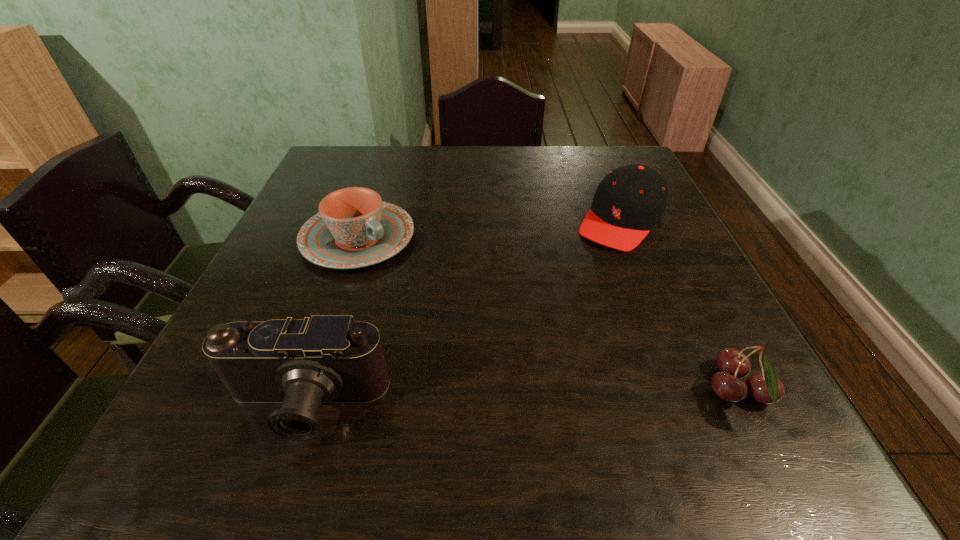
Find the location of `camera positioned at the near edge`. camera positioned at the near edge is located at coordinates (301, 363).

The image size is (960, 540). Identify the location of cherry situated at the near edge. coord(766,388).

The width and height of the screenshot is (960, 540). What are the coordinates of `camera that is at the left edge` in the screenshot? It's located at (301, 363).

Where is `chinaware located in the left edge section of the desktop`? This screenshot has width=960, height=540. chinaware located in the left edge section of the desktop is located at coordinates (354, 228).

This screenshot has height=540, width=960. Find the location of `cherry present at the right edge`. cherry present at the right edge is located at coordinates (766, 388).

Find the location of `cap that is positioned at the right edge`. cap that is positioned at the right edge is located at coordinates (631, 200).

The image size is (960, 540). I want to click on object present at the near left corner, so click(x=301, y=363).

You are a GUI agent. You are given a task and a screenshot of the screen. Output one action in this format:
    pyautogui.click(x=<x>, y=<y>)
    Task: Click on the object positioned at the near right corner
    
    Given the screenshot: What is the action you would take?
    pyautogui.click(x=766, y=388)

The height and width of the screenshot is (540, 960). In order to click on vacant space at the far edge of the desktop in this screenshot , I will do click(x=526, y=182).

The height and width of the screenshot is (540, 960). Identify the location of vacant region at the near edge of the desktop. (573, 373).